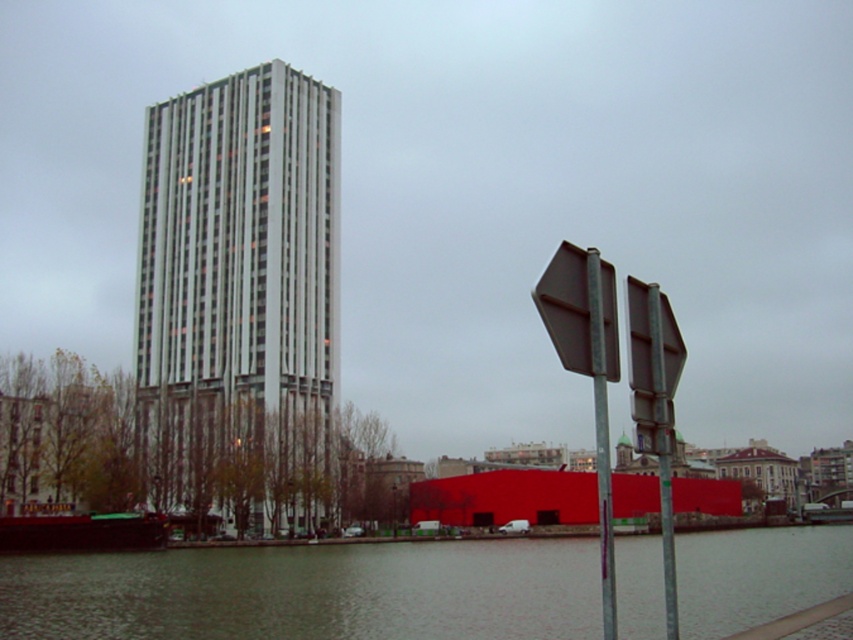
Can you confirm if metallic gray pole at center-right is smaller than metallic gray hexagonal sign at right?

No.

At what (x,y) coordinates should I click in order to perform the action: click on metallic gray pole at center-right. Please return your answer as a coordinate pair (x, y). This screenshot has height=640, width=853. Looking at the image, I should click on (601, 429).

Does point (606, 577) come farther from viewer compared to point (631, 292)?

No, it is not.

At what (x,y) coordinates should I click in order to perform the action: click on metallic gray pole at center-right. Please return your answer as a coordinate pair (x, y). This screenshot has width=853, height=640. Looking at the image, I should click on (601, 429).

Is white glass building at center thinner than metallic gray hexagonal sign at right?

In fact, white glass building at center might be wider than metallic gray hexagonal sign at right.

Between point (173, 228) and point (631, 324), which one is positioned behind?

The point (173, 228) is more distant.

Is point (273, 422) farther from camera compared to point (668, 390)?

Yes, it is behind point (668, 390).

Identify the location of white glass building at center. (236, 276).

Is white glass building at center to the right of brown metallic sign at center-right from the viewer's perspective?

In fact, white glass building at center is to the left of brown metallic sign at center-right.

Does white glass building at center have a smaller size compared to brown metallic sign at center-right?

No, white glass building at center is not smaller than brown metallic sign at center-right.

Find the location of a particular element. The height and width of the screenshot is (640, 853). white glass building at center is located at coordinates (236, 276).